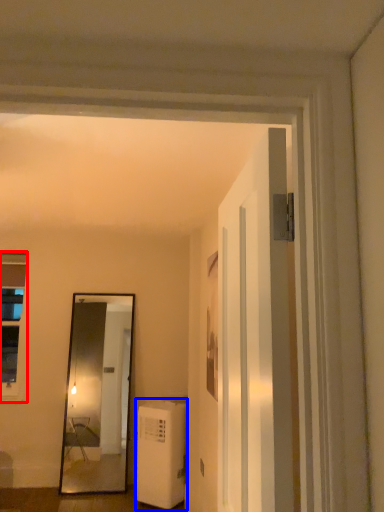
Question: Which point is further to the camera, window (highlighted by a red box) or air conditioner (highlighted by a blue box)?

Choices:
 (A) window
 (B) air conditioner

Answer: (A)